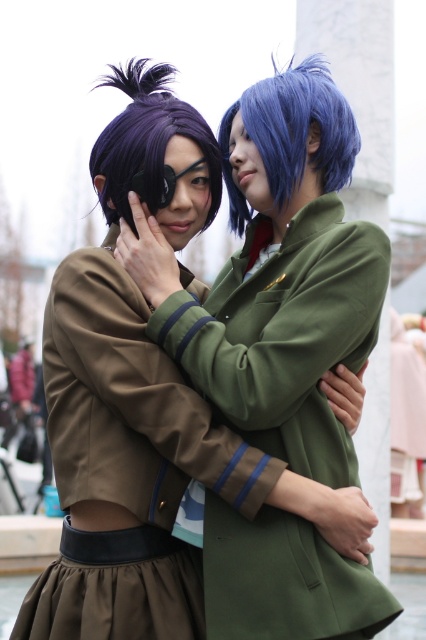
Question: Estimate the real-world distances between objects in this image. Which object is closer to the blue matte wig at center?

Choices:
 (A) olive green fabric uniform at center
 (B) purple matte wig at left

Answer: (B)

Question: Considering the relative positions of olive green fabric uniform at center and purple matte wig at left in the image provided, where is olive green fabric uniform at center located with respect to purple matte wig at left?

Choices:
 (A) below
 (B) above

Answer: (A)

Question: From the image, what is the correct spatial relationship of olive green fabric uniform at center in relation to blue matte wig at center?

Choices:
 (A) below
 (B) above

Answer: (A)

Question: Which of the following is the closest to the observer?

Choices:
 (A) purple matte wig at left
 (B) olive green fabric uniform at center

Answer: (B)

Question: Does blue matte wig at center appear on the right side of purple matte wig at left?

Choices:
 (A) no
 (B) yes

Answer: (B)

Question: Which of the following is the farthest from the observer?

Choices:
 (A) (132, 168)
 (B) (195, 381)

Answer: (A)